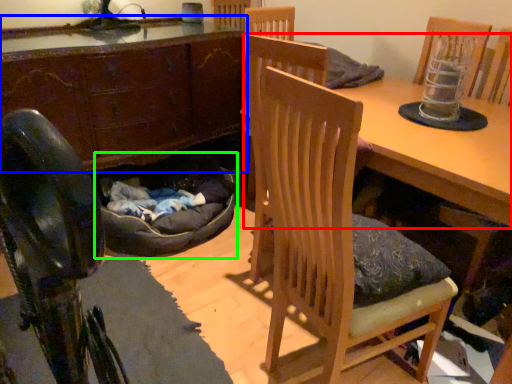
Question: Based on their relative distances, which object is farther from table (highlighted by a red box)? Choose from cabinetry (highlighted by a blue box) and bean bag chair (highlighted by a green box).

Choices:
 (A) cabinetry
 (B) bean bag chair

Answer: (A)